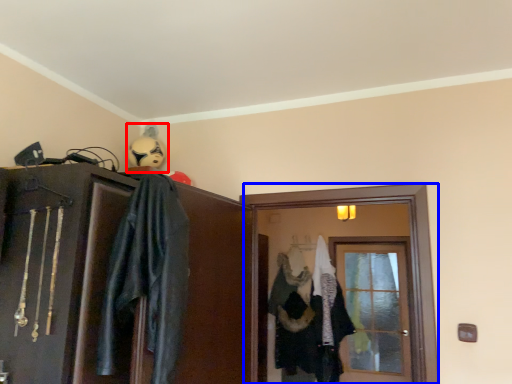
Question: Which point is closer to the camera, comic book character (highlighted by a red box) or screen door (highlighted by a blue box)?

Choices:
 (A) comic book character
 (B) screen door

Answer: (B)